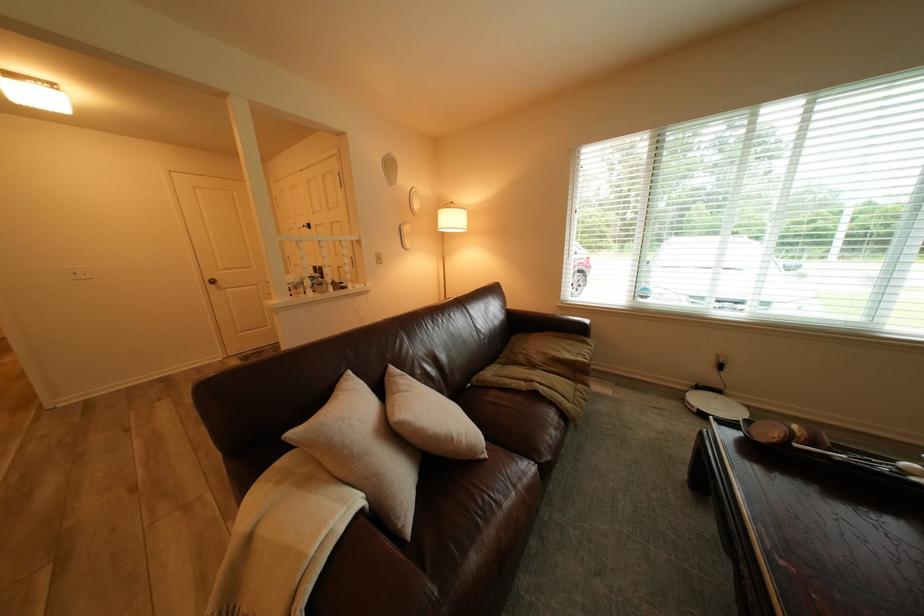
Identify the location of white light switch. The height and width of the screenshot is (616, 924). (76, 273).